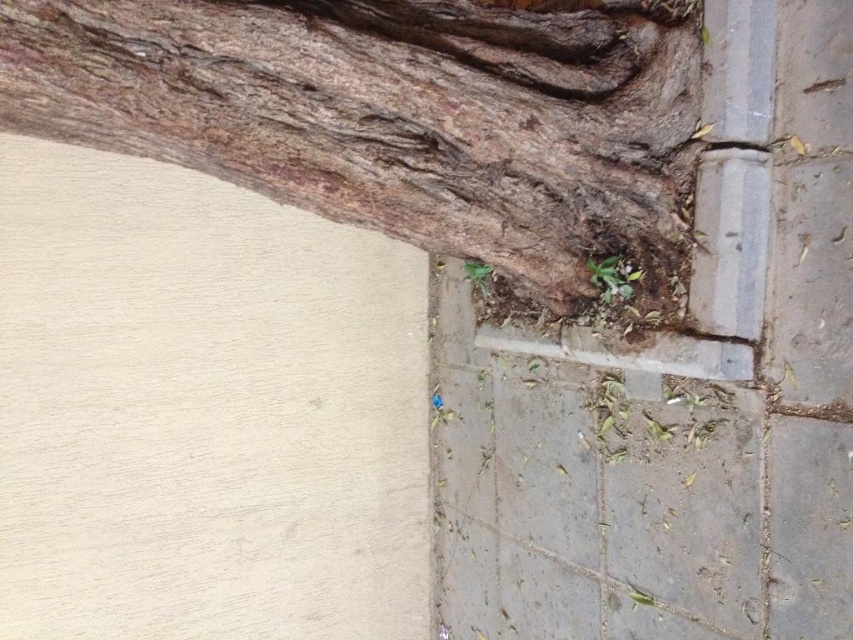
Question: Which of the following is the closest to the observer?

Choices:
 (A) (599, 275)
 (B) (668, 1)
 (C) (477, 282)

Answer: (B)

Question: Which point appears closest to the camera in this image?

Choices:
 (A) (605, 264)
 (B) (599, 221)

Answer: (B)

Question: Which object appears closest to the camera in this image?

Choices:
 (A) brown rough bark at upper left
 (B) green leafy weed at lower right
 (C) green leafy weed at lower center

Answer: (A)

Question: From the image, what is the correct spatial relationship of brown rough bark at upper left in relation to green leafy weed at lower right?

Choices:
 (A) below
 (B) above

Answer: (B)

Question: In this image, where is brown rough bark at upper left located relative to green leafy weed at lower center?

Choices:
 (A) below
 (B) above

Answer: (B)

Question: Does green leafy weed at lower right appear over green leafy weed at lower center?

Choices:
 (A) no
 (B) yes

Answer: (A)